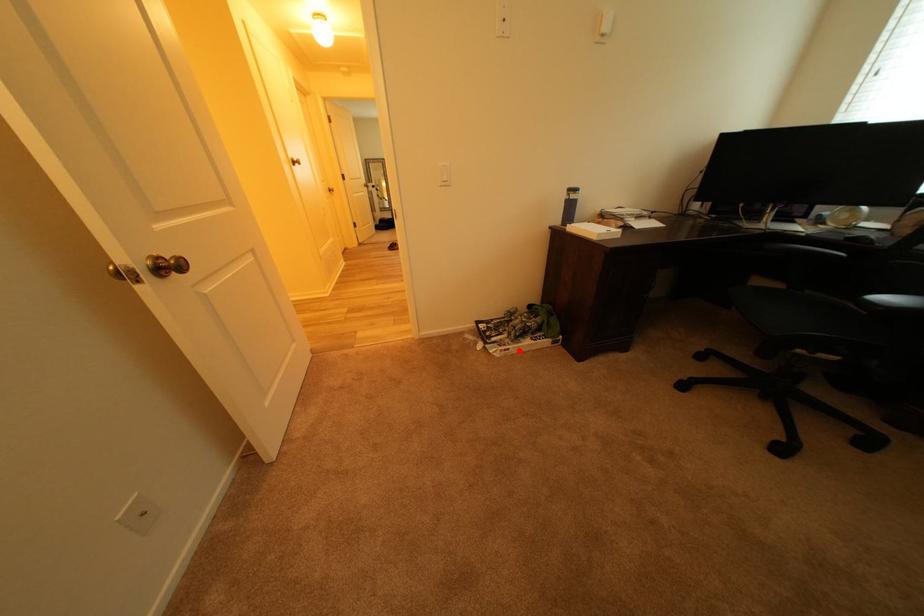
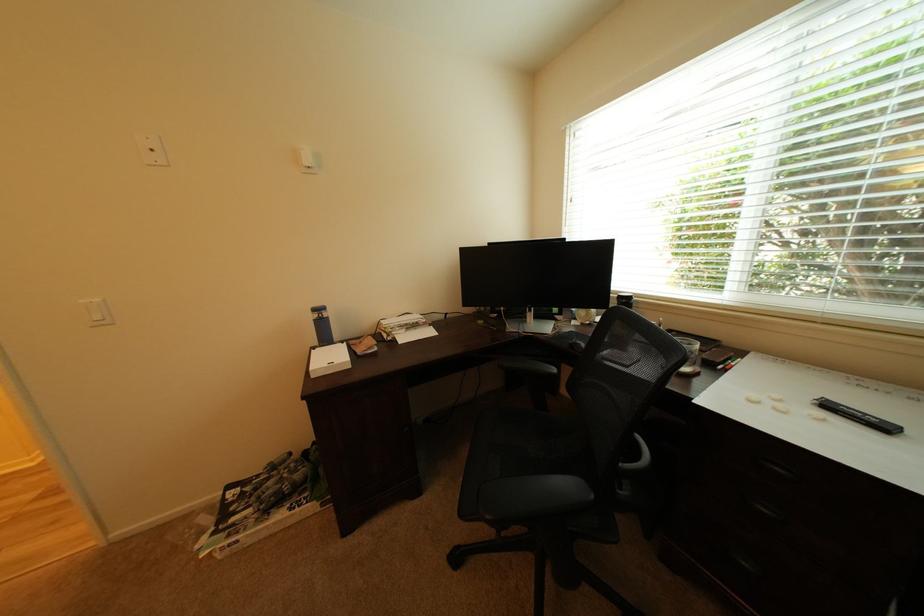
Question: I am providing you with two images of the same scene from different viewpoints. A red point is shown in image1. For the corresponding object point in image2, is it positioned nearer or farther from the camera?

Choices:
 (A) Nearer
 (B) Farther

Answer: (A)